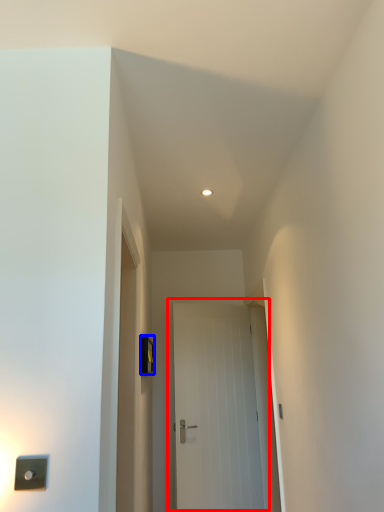
Question: Among these objects, which one is nearest to the camera, door (highlighted by a red box) or light switch (highlighted by a blue box)?

Choices:
 (A) door
 (B) light switch

Answer: (B)